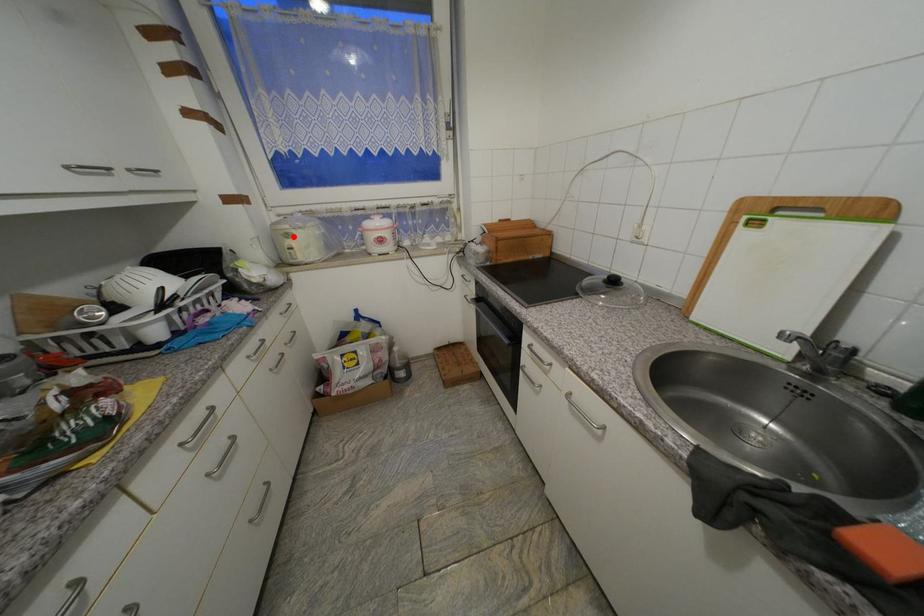
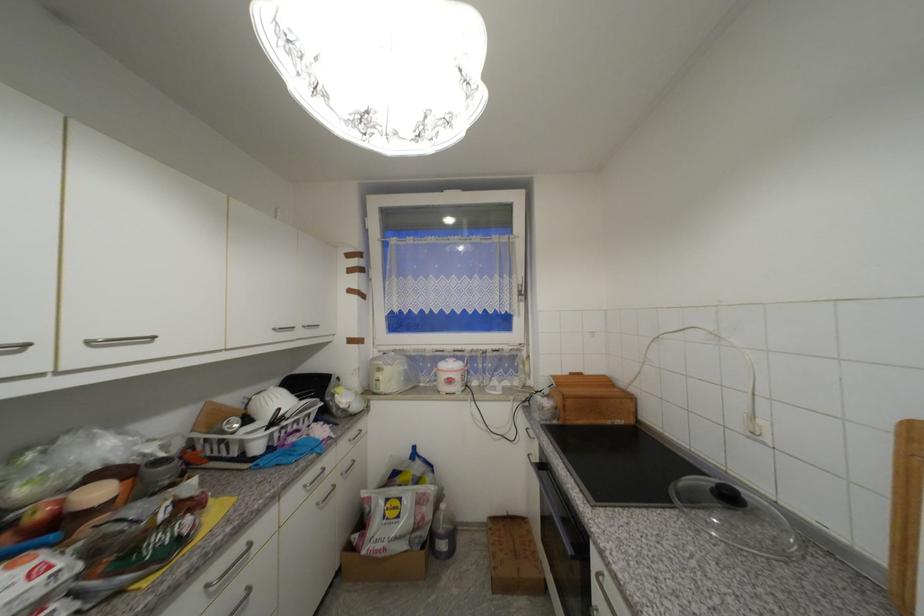
Where in the second image is the point corresponding to the highlighted location from the first image?

(385, 371)